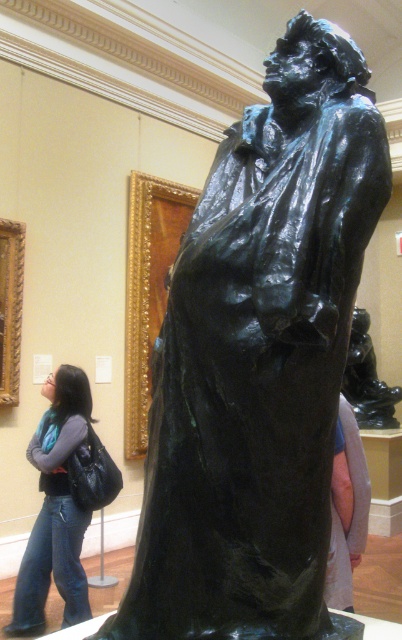
Question: Which point is farther to the camera?

Choices:
 (A) (352, 332)
 (B) (45, 467)

Answer: (A)

Question: Observing the image, what is the correct spatial positioning of denim jeans at lower left in reference to shiny bronze statue at center?

Choices:
 (A) right
 (B) left

Answer: (B)

Question: Among these points, which one is nearest to the camera?

Choices:
 (A) (356, 330)
 (B) (49, 461)

Answer: (B)

Question: Can you confirm if denim jeans at lower left is smaller than shiny bronze statue at center?

Choices:
 (A) yes
 (B) no

Answer: (B)

Question: Is denim jeans at lower left in front of shiny bronze statue at center?

Choices:
 (A) no
 (B) yes

Answer: (B)